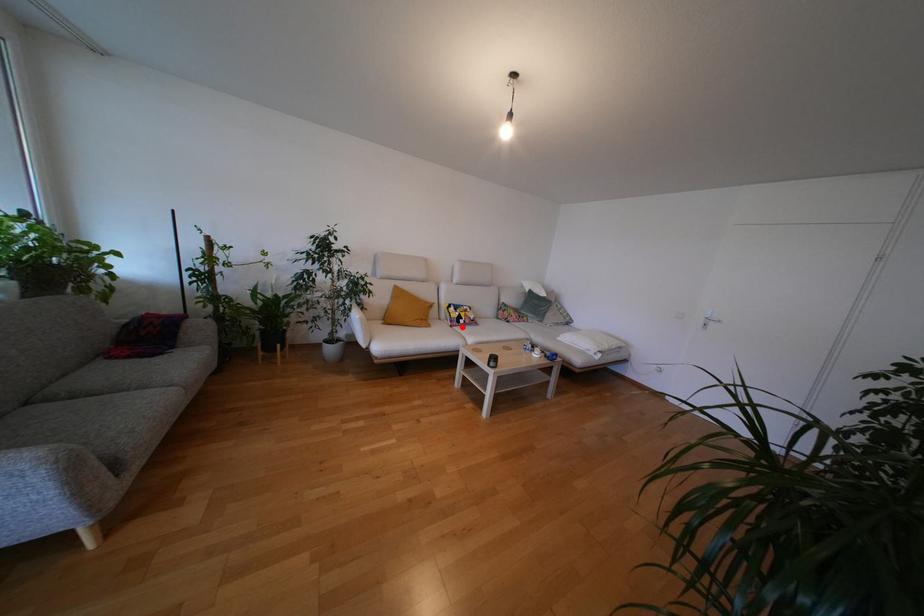
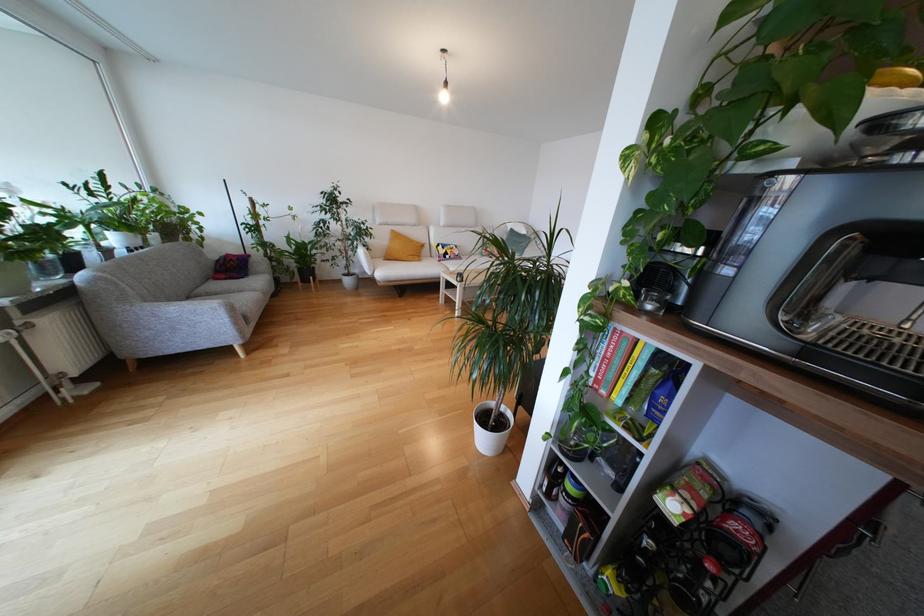
Where in the second image is the point corresponding to the highlighted location from the first image?

(448, 262)